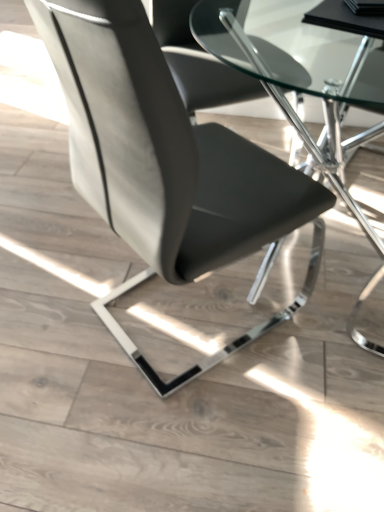
Question: Is point (132, 135) closer or farther from the camera than point (357, 59)?

Choices:
 (A) closer
 (B) farther

Answer: (A)

Question: Visually, is matte black chair at center positioned to the left or to the right of transparent glass table at center?

Choices:
 (A) left
 (B) right

Answer: (A)

Question: Considering the positions of matte black chair at center and transparent glass table at center in the image, is matte black chair at center taller or shorter than transparent glass table at center?

Choices:
 (A) tall
 (B) short

Answer: (A)

Question: Based on their sizes in the image, would you say transparent glass table at center is bigger or smaller than matte black chair at center?

Choices:
 (A) small
 (B) big

Answer: (B)

Question: Based on their positions, is transparent glass table at center located to the left or right of matte black chair at center?

Choices:
 (A) right
 (B) left

Answer: (A)

Question: In terms of height, does transparent glass table at center look taller or shorter compared to matte black chair at center?

Choices:
 (A) tall
 (B) short

Answer: (B)

Question: Is transparent glass table at center spatially inside matte black chair at center, or outside of it?

Choices:
 (A) inside
 (B) outside

Answer: (B)